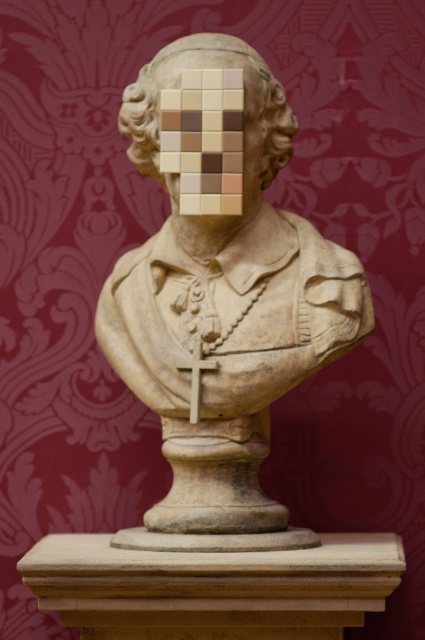
You are standing in front of a classical stone bust on a wooden pedestal. There is a point at coordinates (x=251, y=45). Can you determine if this point is closer to you than 3 meters?

The point at coordinates (x=251, y=45) is 2.89 meters from the viewer, so yes, it is closer than 3 meters.